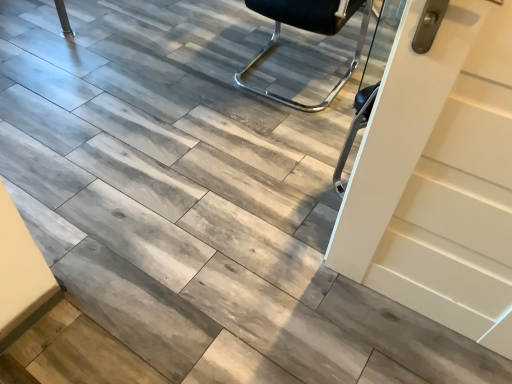
This screenshot has width=512, height=384. What are the coordinates of `free space below black leather chair at center (from a real-world perspective)` in the screenshot? It's located at (284, 74).